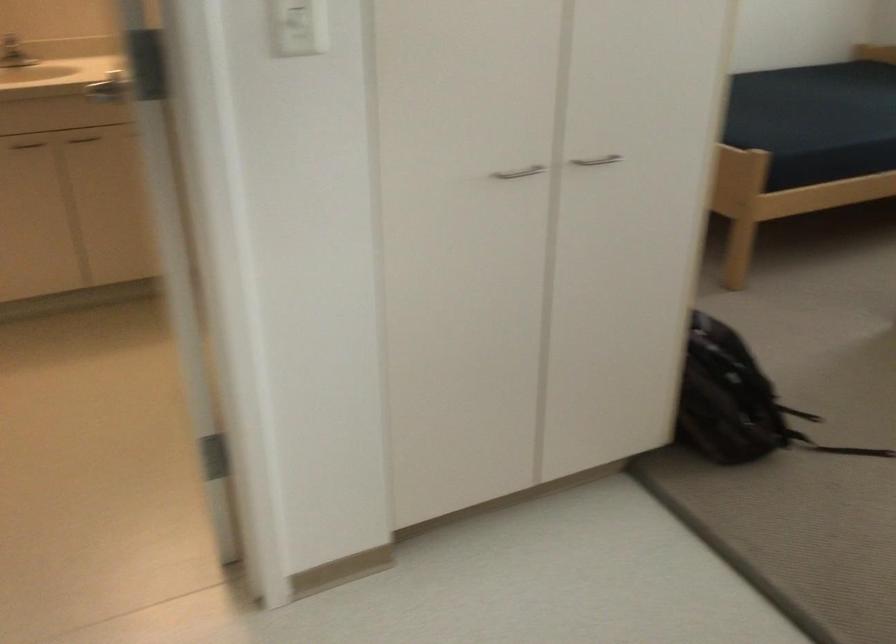
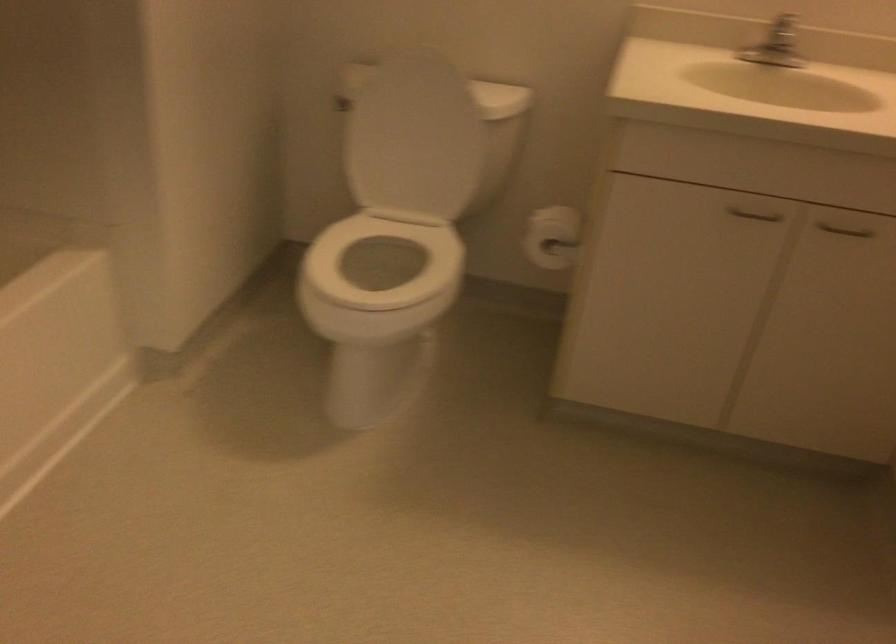
Find the pixel in the second image that matches [71,136] in the first image.

(845, 230)